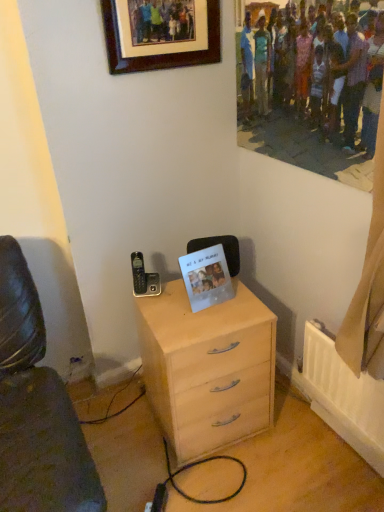
Question: From a real-world perspective, is light wood chest of drawers at center positioned over transparent plastic photo frame at center based on gravity?

Choices:
 (A) no
 (B) yes

Answer: (A)

Question: Is light wood chest of drawers at center touching transparent plastic photo frame at center?

Choices:
 (A) no
 (B) yes

Answer: (A)

Question: Could you tell me if light wood chest of drawers at center is turned towards transparent plastic photo frame at center?

Choices:
 (A) yes
 (B) no

Answer: (B)

Question: From a real-world perspective, does light wood chest of drawers at center sit lower than transparent plastic photo frame at center?

Choices:
 (A) no
 (B) yes

Answer: (B)

Question: Is light wood chest of drawers at center smaller than transparent plastic photo frame at center?

Choices:
 (A) yes
 (B) no

Answer: (B)

Question: Considering the positions of light wood chest of drawers at center and brown wooden picture frame at upper center in the image, is light wood chest of drawers at center wider or thinner than brown wooden picture frame at upper center?

Choices:
 (A) thin
 (B) wide

Answer: (B)

Question: Is light wood chest of drawers at center bigger or smaller than brown wooden picture frame at upper center?

Choices:
 (A) big
 (B) small

Answer: (A)

Question: From a real-world perspective, is light wood chest of drawers at center physically located above or below brown wooden picture frame at upper center?

Choices:
 (A) below
 (B) above

Answer: (A)

Question: Considering the positions of point (173, 440) and point (201, 54), is point (173, 440) closer or farther from the camera than point (201, 54)?

Choices:
 (A) closer
 (B) farther

Answer: (A)

Question: Looking at their shapes, would you say light wood chest of drawers at center is wider or thinner than transparent plastic photo frame at center?

Choices:
 (A) wide
 (B) thin

Answer: (A)

Question: From a real-world perspective, relative to transparent plastic photo frame at center, is light wood chest of drawers at center vertically above or below?

Choices:
 (A) below
 (B) above

Answer: (A)

Question: Considering the positions of light wood chest of drawers at center and transparent plastic photo frame at center in the image, is light wood chest of drawers at center taller or shorter than transparent plastic photo frame at center?

Choices:
 (A) short
 (B) tall

Answer: (B)

Question: Is light wood chest of drawers at center situated inside transparent plastic photo frame at center or outside?

Choices:
 (A) outside
 (B) inside

Answer: (A)

Question: Is transparent plastic photo frame at center spatially inside light wood chest of drawers at center, or outside of it?

Choices:
 (A) inside
 (B) outside

Answer: (B)

Question: Relative to light wood chest of drawers at center, is transparent plastic photo frame at center in front or behind?

Choices:
 (A) front
 (B) behind

Answer: (B)